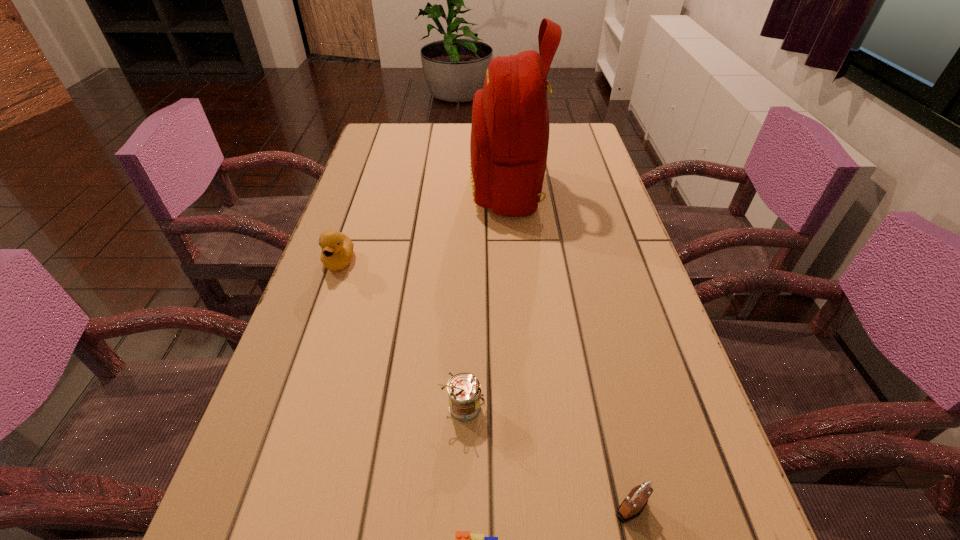
Where is `free region located on the back of the can`? This screenshot has width=960, height=540. free region located on the back of the can is located at coordinates (468, 273).

Locate an element on the screen. The image size is (960, 540). vacant position located 0.250m facing forward on the leftmost object is located at coordinates (301, 373).

This screenshot has width=960, height=540. I want to click on blank space located on the back of the second nearest object, so click(602, 382).

The height and width of the screenshot is (540, 960). I want to click on object located at the left edge, so click(x=337, y=249).

Find the location of a particular element. object that is at the right edge is located at coordinates (632, 506).

This screenshot has height=540, width=960. I want to click on vacant space at the far edge of the desktop, so click(441, 153).

In the image, there is a desktop. Where is `vacant space at the left edge`? vacant space at the left edge is located at coordinates (222, 539).

In the image, there is a desktop. Identify the location of vacant space at the right edge. (575, 201).

Find the location of a particular element. free location at the far left corner is located at coordinates (404, 156).

The width and height of the screenshot is (960, 540). I want to click on vacant space at the far right corner of the desktop, so click(x=574, y=141).